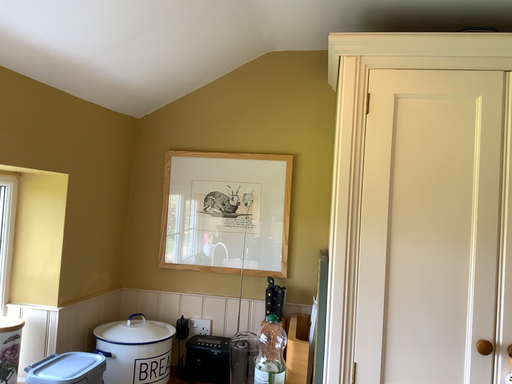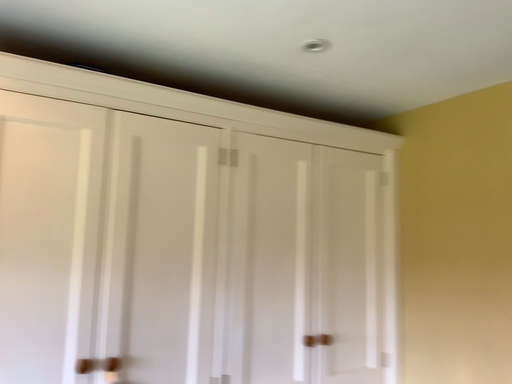
Question: How did the camera likely rotate when shooting the video?

Choices:
 (A) rotated left
 (B) rotated right

Answer: (B)